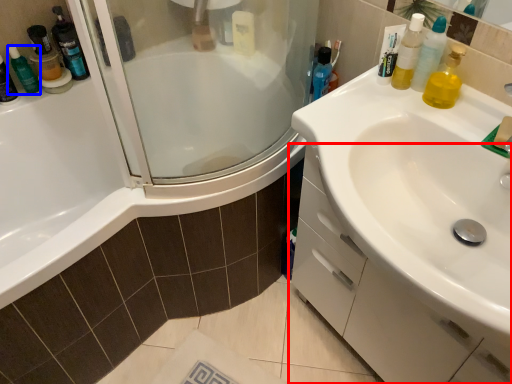
Question: Which point is further to the camera, bathroom cabinet (highlighted by a red box) or toiletry (highlighted by a blue box)?

Choices:
 (A) bathroom cabinet
 (B) toiletry

Answer: (B)